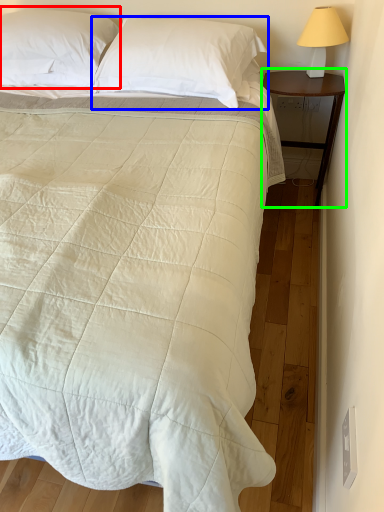
Question: Which is nearer to the pillow (highlighted by a red box)? pillow (highlighted by a blue box) or nightstand (highlighted by a green box).

Choices:
 (A) pillow
 (B) nightstand

Answer: (A)